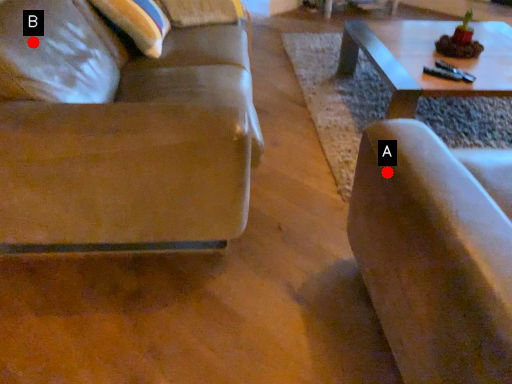
Question: Two points are circled on the image, labeled by A and B beside each circle. Which point is farther from the camera taking this photo?

Choices:
 (A) A is further
 (B) B is further

Answer: (B)